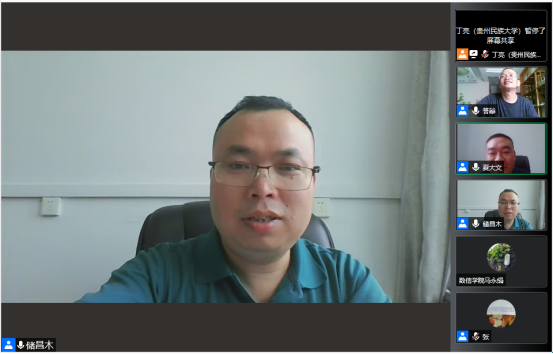
This screenshot has width=553, height=354. Identify the location of wall. (97, 142).